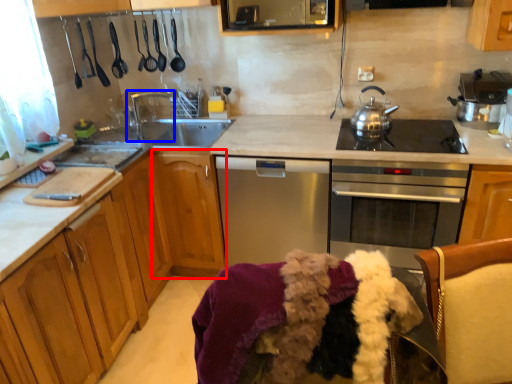
Question: Among these objects, which one is nearest to the camera, cabinetry (highlighted by a red box) or tap (highlighted by a blue box)?

Choices:
 (A) cabinetry
 (B) tap

Answer: (A)